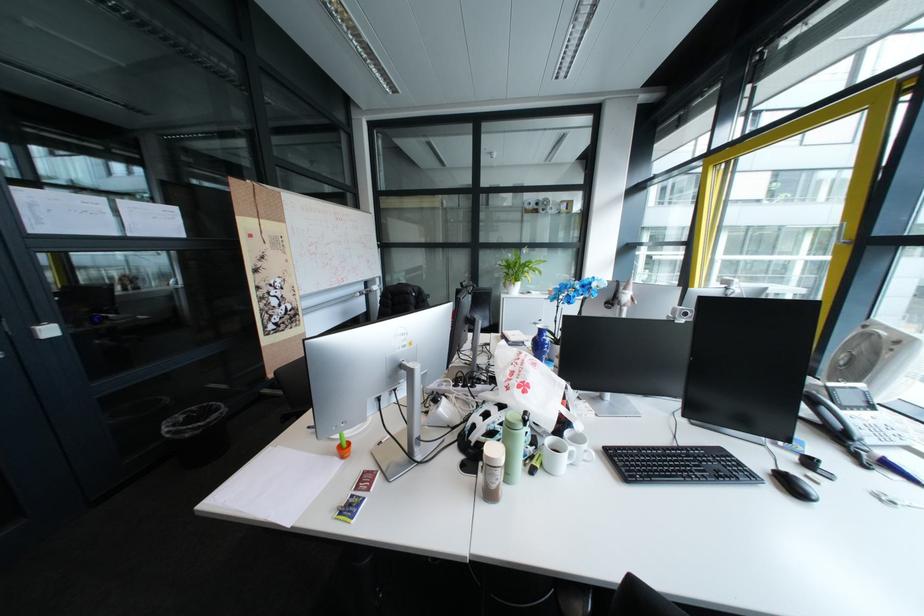
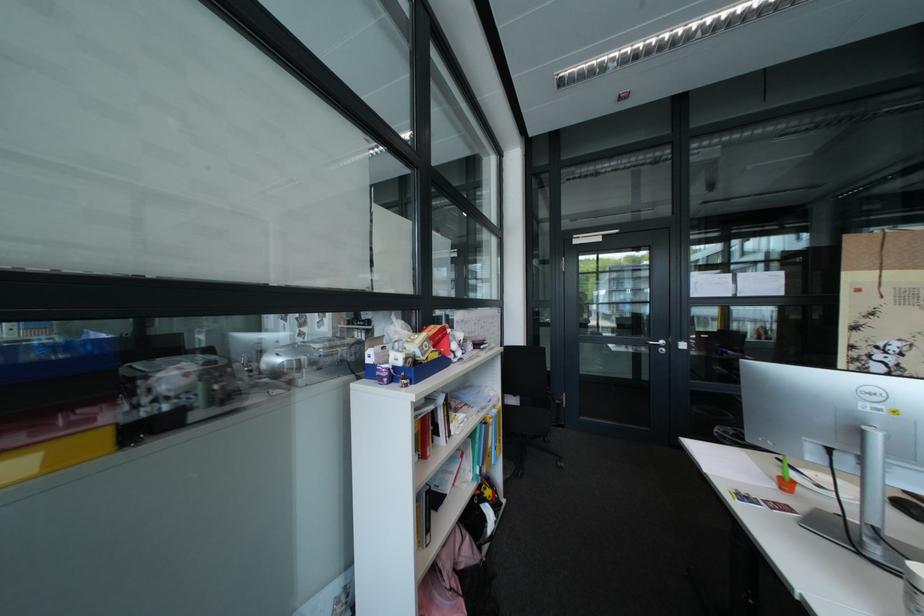
Question: Based on the continuous images, in which direction is the camera rotating? Reply with the corresponding letter.

Choices:
 (A) Left
 (B) Right
 (C) Up
 (D) Down

Answer: (A)